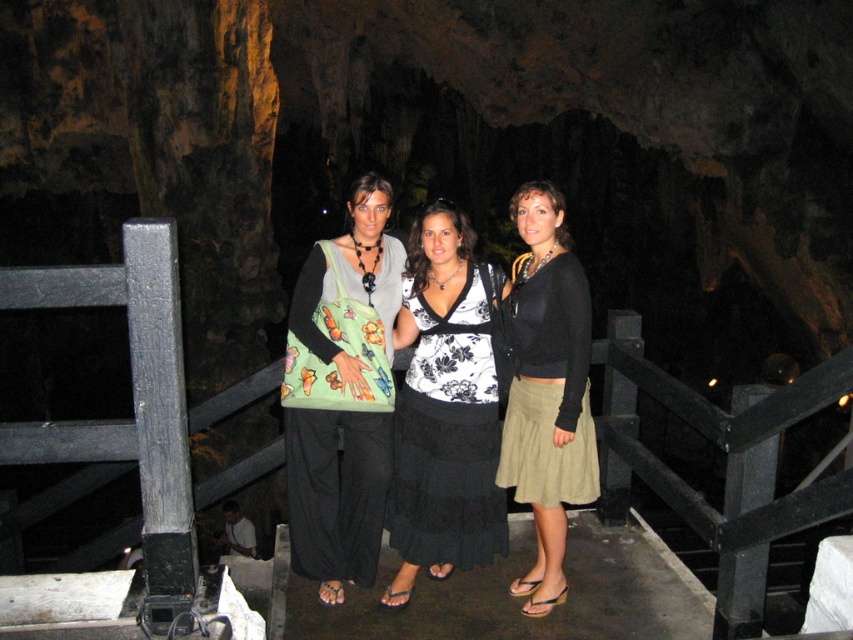
Question: Which of the following is the farthest from the observer?

Choices:
 (A) (518, 376)
 (B) (505, 294)
 (C) (294, 296)

Answer: (A)

Question: Which point is farther from the camera taking this photo?

Choices:
 (A) (509, 428)
 (B) (397, 589)
 (C) (392, 465)

Answer: (A)

Question: Is the position of green fabric bag at center less distant than that of black floral dress at center?

Choices:
 (A) no
 (B) yes

Answer: (B)

Question: Can you confirm if black floral dress at center is bigger than olive-green skirt at center?

Choices:
 (A) yes
 (B) no

Answer: (B)

Question: Does black floral dress at center have a lesser width compared to olive-green skirt at center?

Choices:
 (A) no
 (B) yes

Answer: (A)

Question: Which point is farther from the camera taking this photo?

Choices:
 (A) (344, 468)
 (B) (399, 330)

Answer: (B)